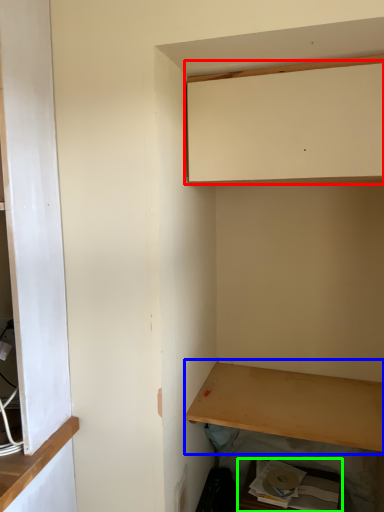
Question: Which object is the farthest from cabinetry (highlighted by a red box)? Choose among these: shelf (highlighted by a blue box) or cabinetry (highlighted by a green box).

Choices:
 (A) shelf
 (B) cabinetry

Answer: (B)